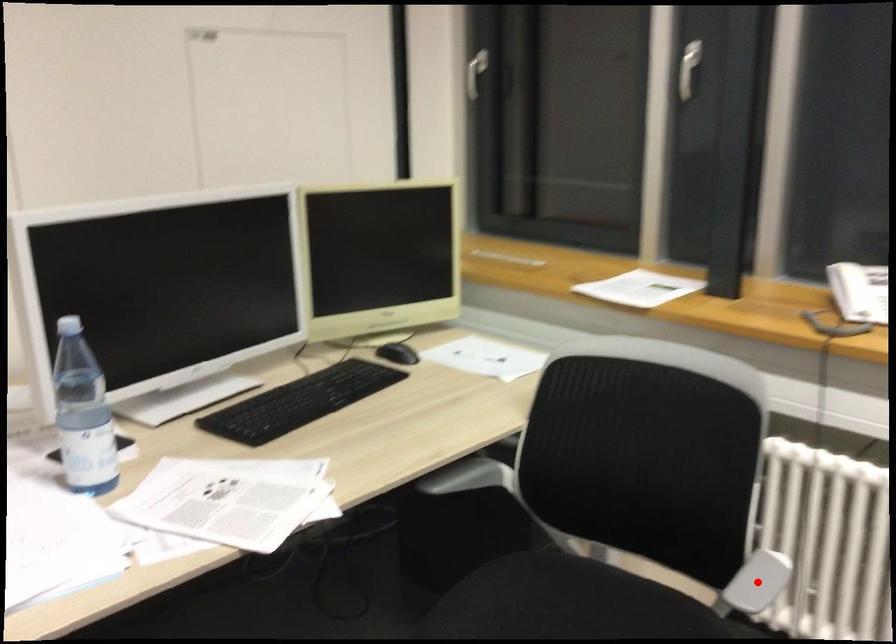
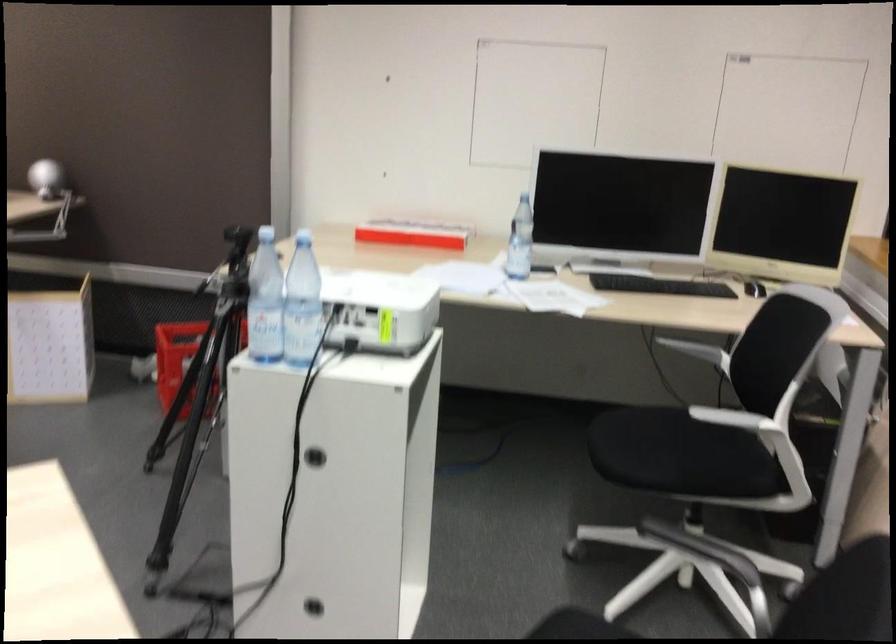
Question: I am providing you with two images of the same scene from different viewpoints. Image1 has a red point marked. In image2, the corresponding 3D location appears at what relative position? Reply with the corresponding letter.

Choices:
 (A) Closer
 (B) Farther

Answer: (B)